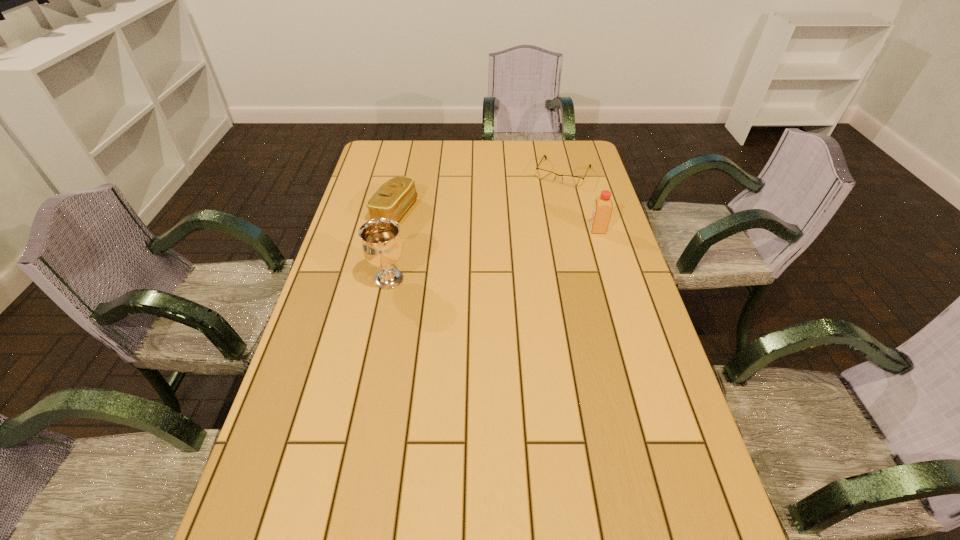
This screenshot has height=540, width=960. In order to click on vacant spot on the desktop that is between the chalice and the orange juice and is positioned on the zipper side of the second shortest object in this screenshot , I will do `click(520, 248)`.

The image size is (960, 540). What are the coordinates of `vacant space on the desktop that is between the tallest object and the orange juice and is positioned on the front-facing side of the farthest object` in the screenshot? It's located at [x=527, y=246].